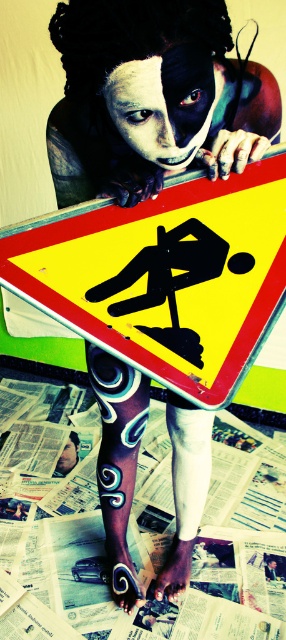
You are an art curator planning to display a sculpture of the black matte face at center. The sculpture will be placed on a stand that can only hold items above the yellow paper at center. Will the sculpture be visible from the front of the display?

The yellow paper at center is located below the black matte face at center, so the sculpture of the black matte face at center will be visible from the front as it is positioned above the yellow paper at center.

Based on the scene description, which object is wider, the yellow paper at center or the black matte face at center?

The yellow paper at center might be wider than the black matte face at center according to the description.